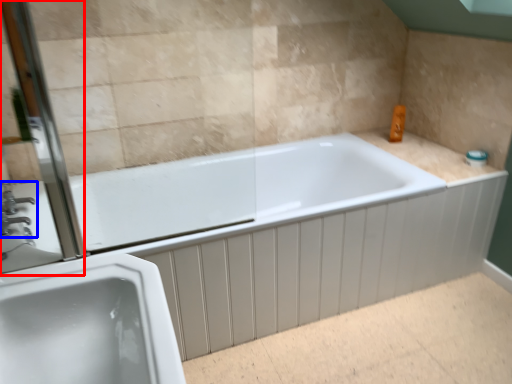
Question: Which object is closer to the camera taking this photo, screen door (highlighted by a red box) or tap (highlighted by a blue box)?

Choices:
 (A) screen door
 (B) tap

Answer: (A)